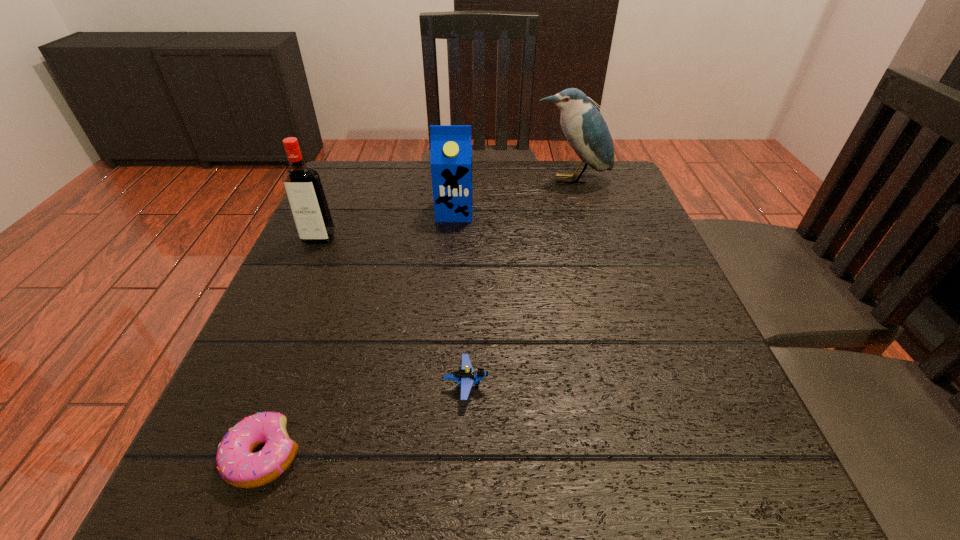
At what (x,y) coordinates should I click in order to perform the action: click on vacant space that's between the farthest object and the carton. Please return your answer as a coordinate pair (x, y). Looking at the image, I should click on (513, 195).

You are a GUI agent. You are given a task and a screenshot of the screen. Output one action in this format:
    pyautogui.click(x=<x>, y=<y>)
    Task: Click on the empty location between the vodka and the fourth nearest object
    The width and height of the screenshot is (960, 540).
    Given the screenshot: What is the action you would take?
    pyautogui.click(x=387, y=225)

I want to click on free area in between the farthest object and the shortest object, so click(x=418, y=318).

The width and height of the screenshot is (960, 540). I want to click on vacant space in between the carton and the doughnut, so click(x=359, y=334).

The height and width of the screenshot is (540, 960). Find the location of `blank region between the carton and the Lego`. blank region between the carton and the Lego is located at coordinates (460, 299).

Locate an element on the screen. the closest object to the rightmost object is located at coordinates (451, 146).

Where is `object that is the closest to the Lego`? The width and height of the screenshot is (960, 540). object that is the closest to the Lego is located at coordinates (237, 465).

The height and width of the screenshot is (540, 960). I want to click on vacant point that satisfies the following two spatial constraints: 1. on the front and back of the nearest object; 2. on the left side of the vodka, so click(222, 456).

You are a GUI agent. You are given a task and a screenshot of the screen. Output one action in this format:
    pyautogui.click(x=<x>, y=<y>)
    Task: Click on the vacant space that satisfies the following two spatial constraints: 1. on the front and back of the vodka; 2. on the right side of the shortest object
    This screenshot has height=540, width=960.
    Given the screenshot: What is the action you would take?
    pyautogui.click(x=222, y=456)

Identify the location of free space that satisfies the following two spatial constraints: 1. at the tip of the rightmost object's beak; 2. on the front-facing side of the Lego. pos(634,385).